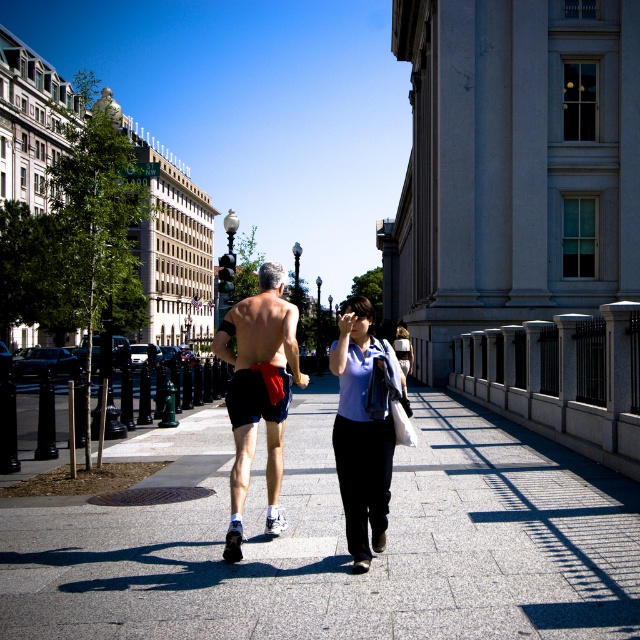
Question: Which point is farther to the camera?

Choices:
 (A) matte black shorts at center
 (B) matte blue shirt at center
 (C) dark blue shorts at center
 (D) paved stone sidewalk at center

Answer: (A)

Question: Which point is farther from the camera taking this photo?

Choices:
 (A) (291, 344)
 (B) (234, 468)

Answer: (A)

Question: Does dark blue shorts at center have a smaller size compared to matte blue shirt at center?

Choices:
 (A) no
 (B) yes

Answer: (B)

Question: Can you confirm if matte black shorts at center is positioned to the right of matte blue shirt at center?

Choices:
 (A) yes
 (B) no

Answer: (B)

Question: Is paved stone sidewalk at center thinner than matte blue shirt at center?

Choices:
 (A) no
 (B) yes

Answer: (A)

Question: Estimate the real-world distances between objects in this image. Which object is farther from the dark blue shorts at center?

Choices:
 (A) matte black shorts at center
 (B) paved stone sidewalk at center
 (C) matte blue shirt at center

Answer: (B)